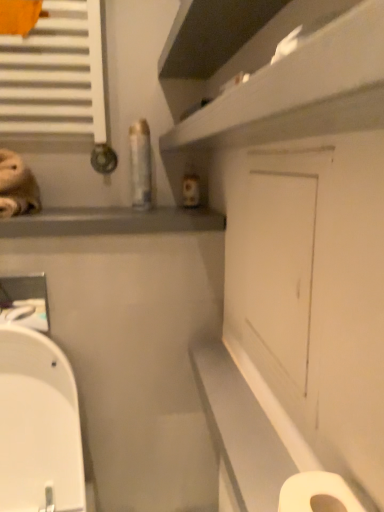
The height and width of the screenshot is (512, 384). Identify the location of vacant space situated above matte gray window sill at upper left (from a real-world perspective). (105, 212).